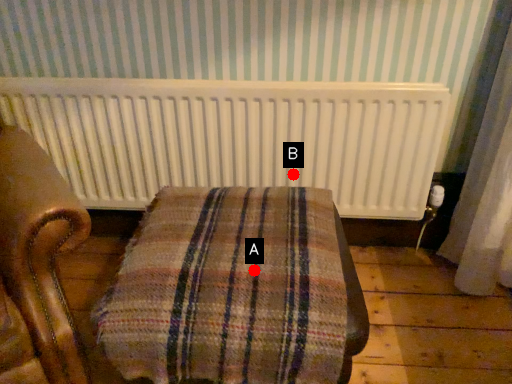
Question: Two points are circled on the image, labeled by A and B beside each circle. Which point appears farthest from the camera in this image?

Choices:
 (A) A is further
 (B) B is further

Answer: (B)